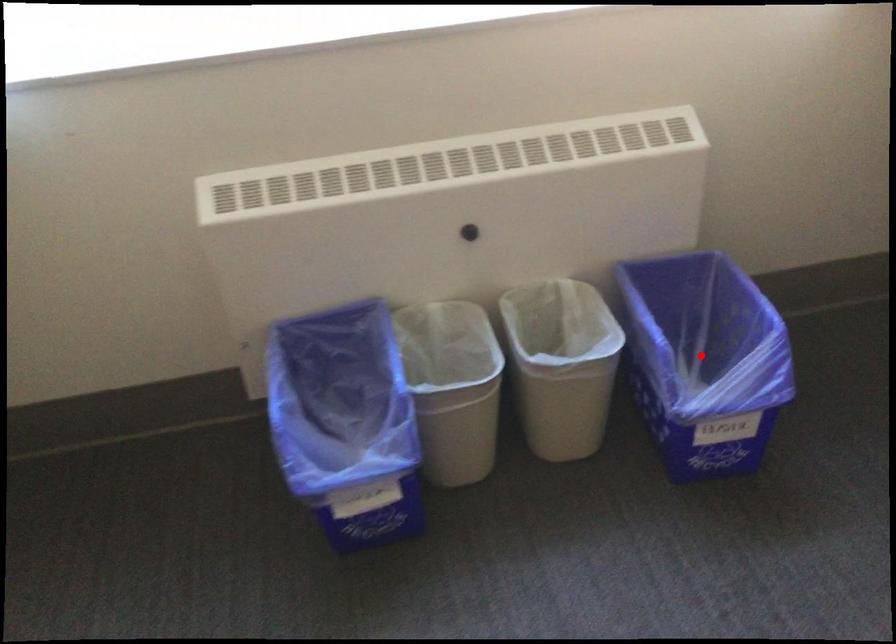
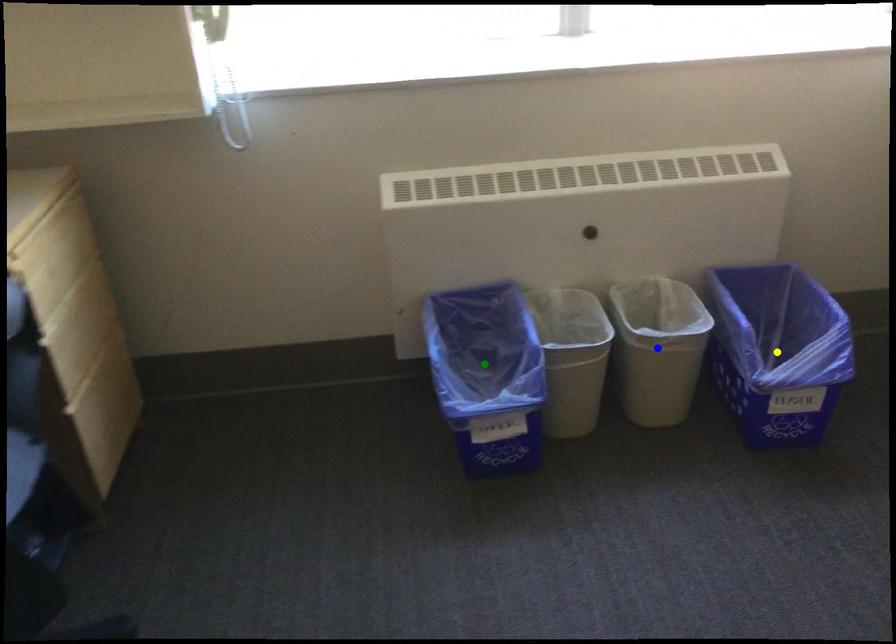
Question: I am providing you with two images of the same scene from different viewpoints. A red point is marked on the first image. You are given multiple points on the second image. Which point in image 2 is actually the same real-world point as the red point in image 1?

Choices:
 (A) blue point
 (B) green point
 (C) yellow point

Answer: (C)